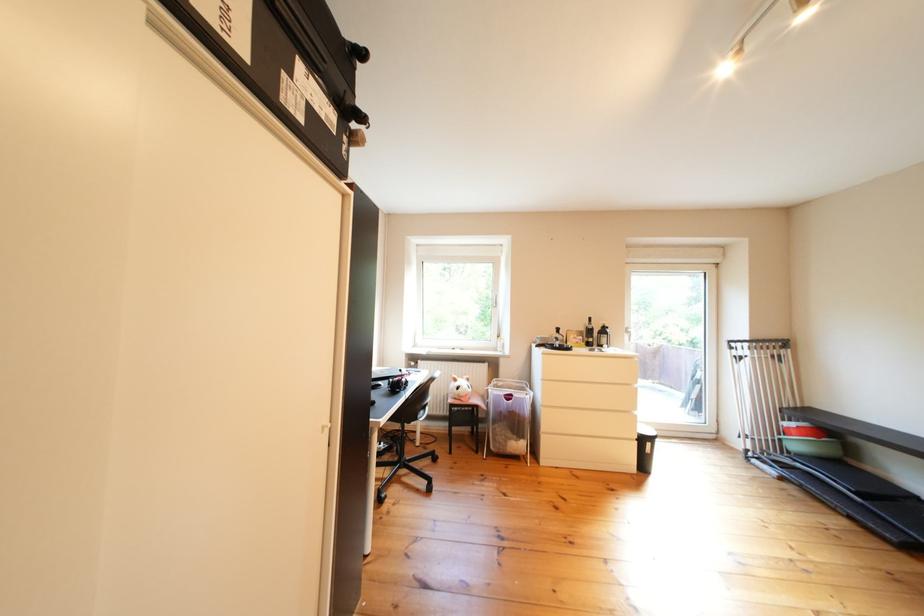
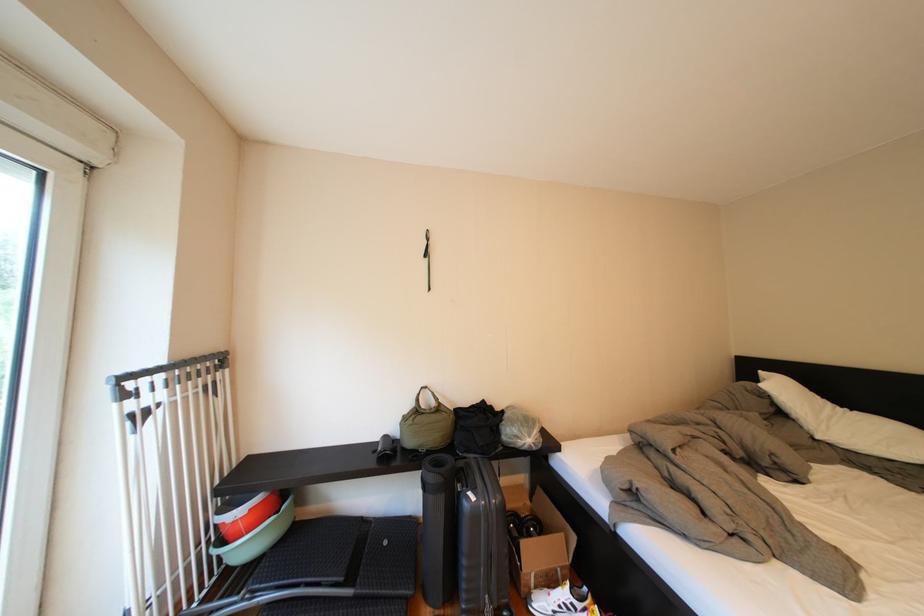
Locate, in the second image, the point that corresponds to (x=877, y=509) in the first image.

(370, 602)